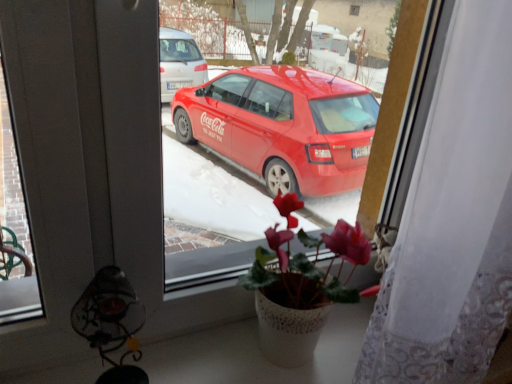
Locate an element on the screen. vacant space that is in between pink matte cyclamen at center and metallic wire lamp at lower left is located at coordinates (211, 361).